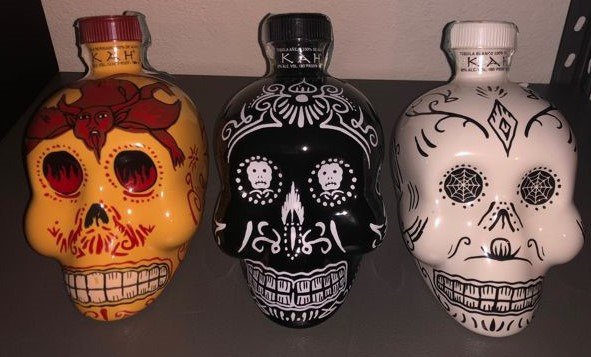
Image resolution: width=591 pixels, height=357 pixels. What are the coordinates of `white wall` in the screenshot? It's located at (376, 37).